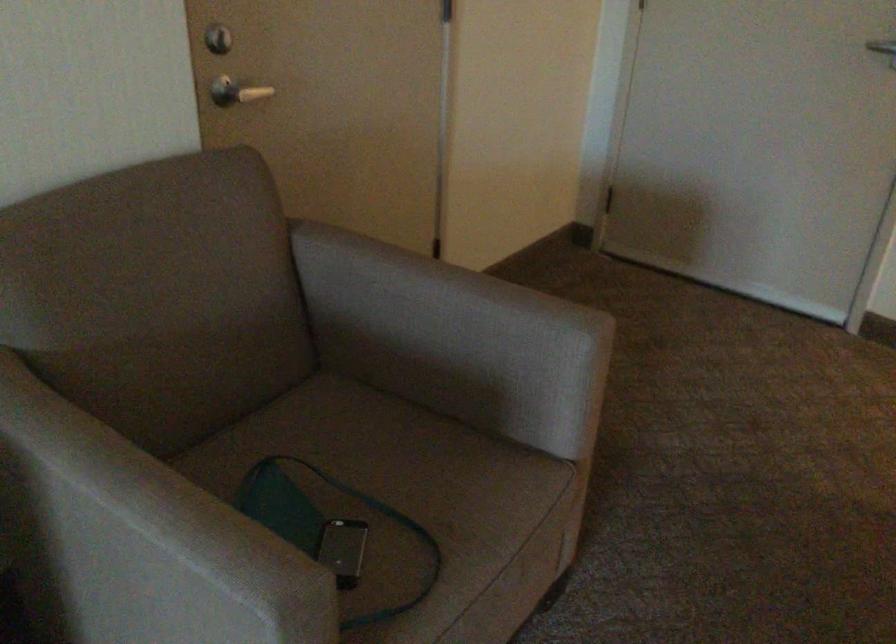
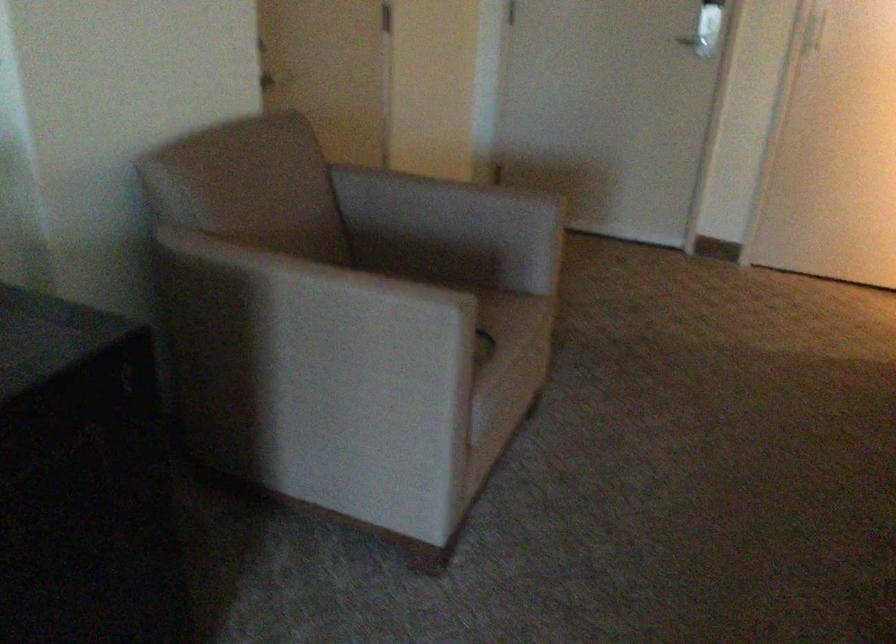
Where in the second image is the point corresponding to point (476, 569) from the first image?

(513, 345)